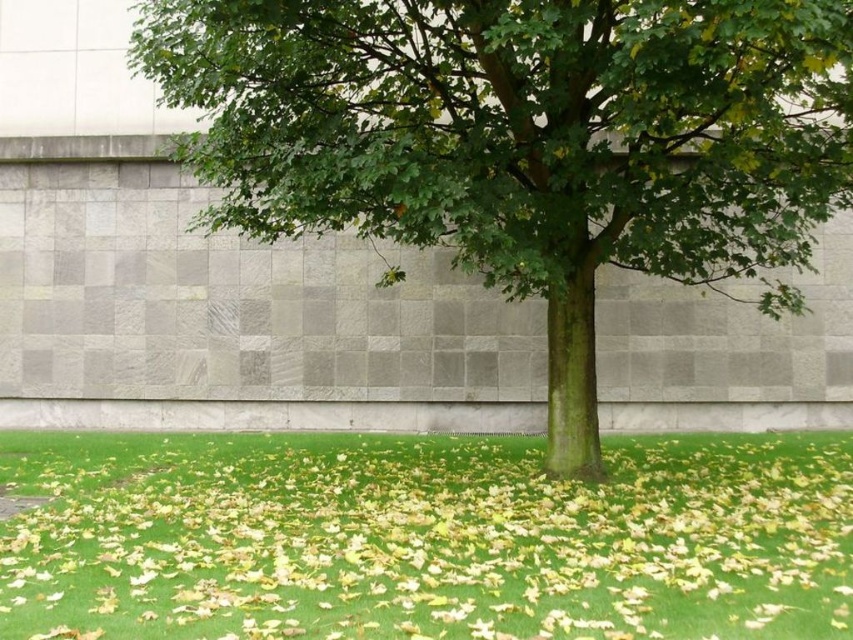
Question: Which of the following is the closest to the observer?

Choices:
 (A) green grass at center
 (B) green leafy tree at center

Answer: (A)

Question: Can you confirm if green leafy tree at center is smaller than green grass at center?

Choices:
 (A) no
 (B) yes

Answer: (B)

Question: From the image, what is the correct spatial relationship of green leafy tree at center in relation to green grass at center?

Choices:
 (A) below
 (B) above

Answer: (B)

Question: Is green leafy tree at center positioned before green grass at center?

Choices:
 (A) no
 (B) yes

Answer: (A)